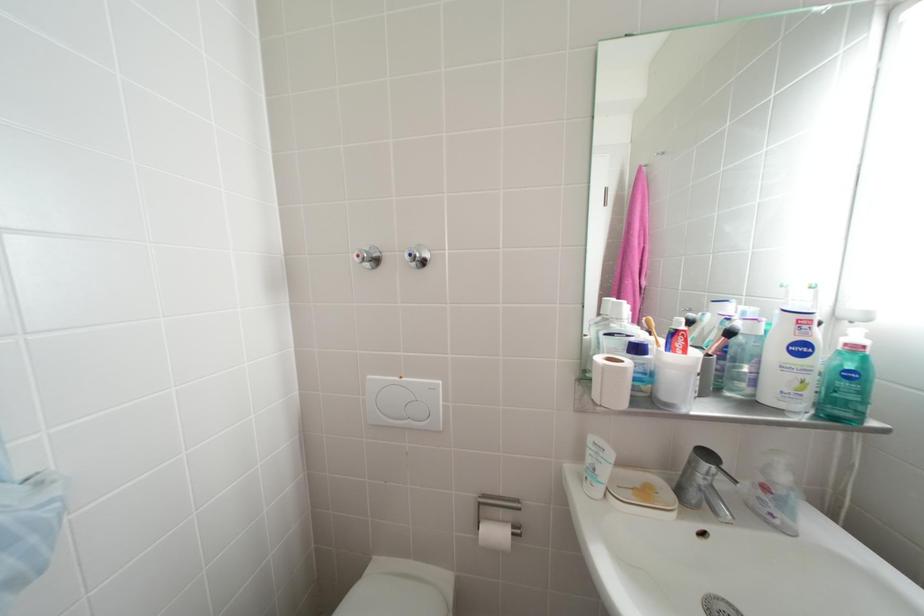
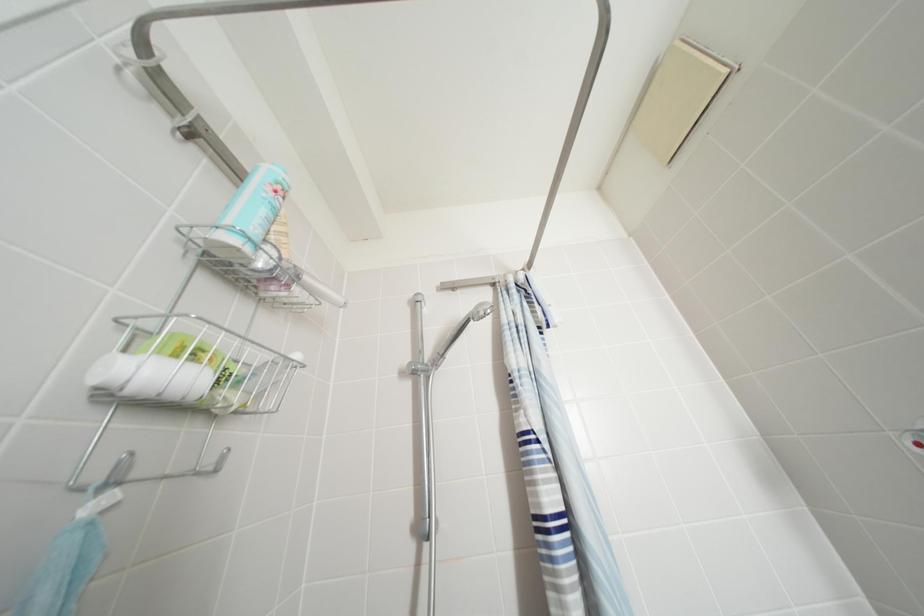
First-person continuous shooting, in which direction is the camera rotating?

The rotation direction of the camera is left-up.